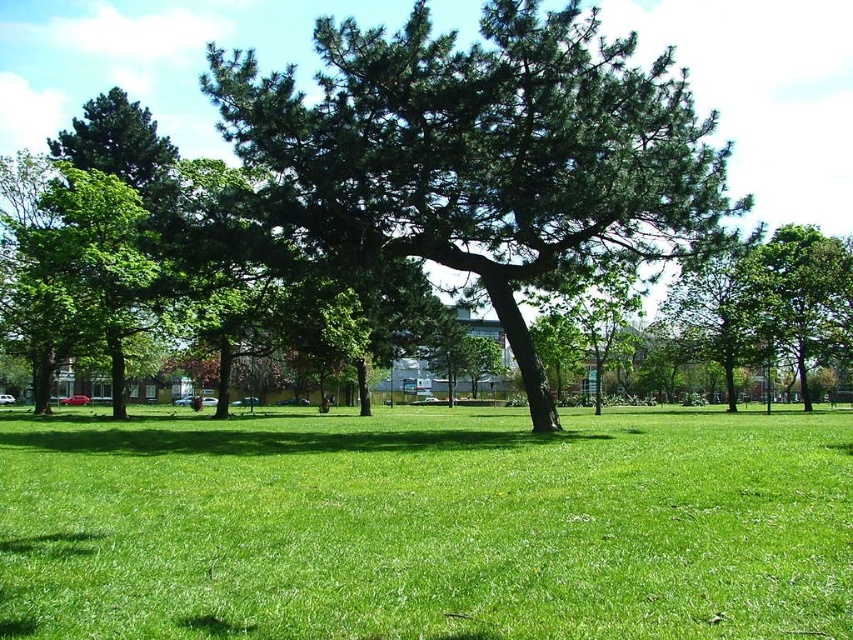
You are standing in the park and see the green grassy field at center and the green leafy tree at center. Which one is located to the left of the other?

The green grassy field at center is positioned on the left side of green leafy tree at center.

You are planning to set up a picnic blanket in the park. You want to place it between the green grassy field at center and the green leafy tree at center. How much space in feet will be between the picnic blanket and each object if you place it exactly halfway between them?

The green grassy field at center and green leafy tree at center are 9.97 feet apart. Placing the picnic blanket exactly halfway would mean it is 4.985 feet away from both objects.